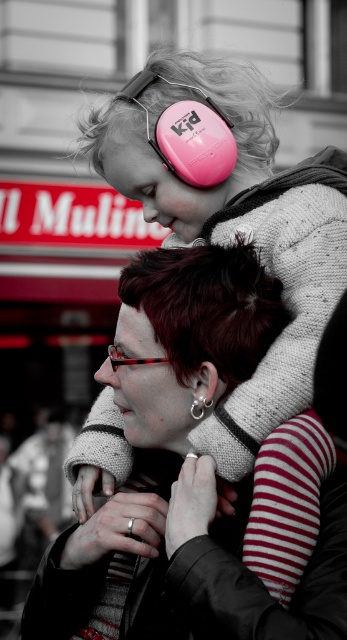
Question: Observing the image, what is the correct spatial positioning of matte black jacket at center in reference to dark red hair at center?

Choices:
 (A) below
 (B) above

Answer: (A)

Question: From the image, what is the correct spatial relationship of pink matte ear protection at upper center in relation to translucent red glasses at center?

Choices:
 (A) below
 (B) above

Answer: (B)

Question: Which object is farther from the camera taking this photo?

Choices:
 (A) matte black jacket at center
 (B) translucent red glasses at center
 (C) pink matte ear protection at upper center

Answer: (C)

Question: Which point is closer to the camera?

Choices:
 (A) translucent red glasses at center
 (B) pink matte ear protection at upper center
 (C) matte black jacket at center

Answer: (C)

Question: From the image, what is the correct spatial relationship of dark red hair at center in relation to pink matte ear protection at upper center?

Choices:
 (A) below
 (B) above

Answer: (A)

Question: Which of these objects is positioned closest to the translucent red glasses at center?

Choices:
 (A) dark red hair at center
 (B) pink matte ear protection at upper center

Answer: (A)